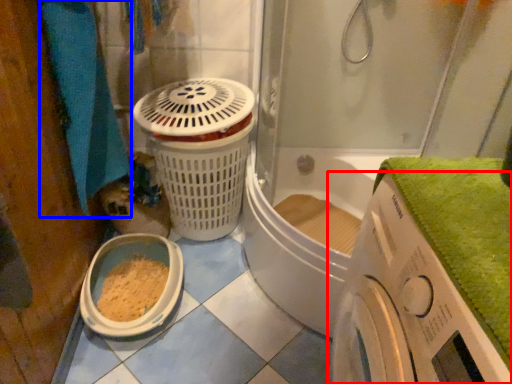
Question: Which of the following is the farthest to the observer, washing machine (highlighted by a red box) or bath towel (highlighted by a blue box)?

Choices:
 (A) washing machine
 (B) bath towel

Answer: (B)